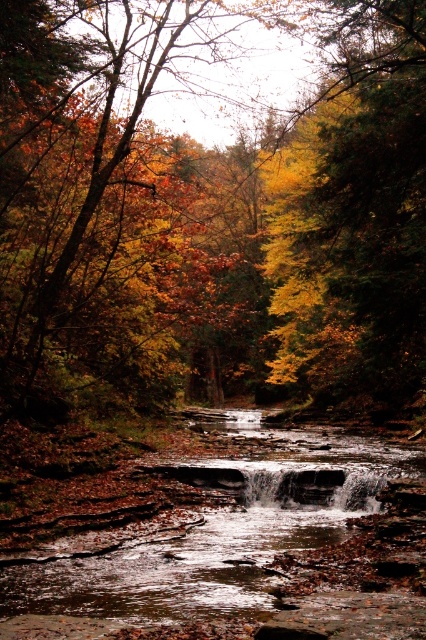
Question: Is yellow/golden leaves at center closer to camera compared to smooth rock stream at center?

Choices:
 (A) yes
 (B) no

Answer: (B)

Question: In this image, where is yellow/golden leaves at center located relative to smooth rock stream at center?

Choices:
 (A) above
 (B) below

Answer: (A)

Question: Does yellow/golden leaves at center appear on the right side of smooth rock stream at center?

Choices:
 (A) yes
 (B) no

Answer: (B)